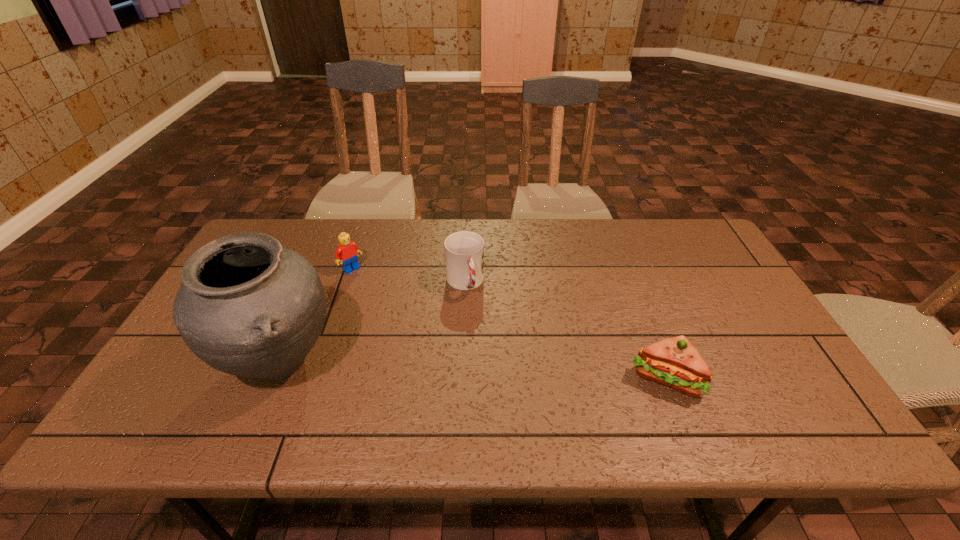
Identify the location of vacant area situated 0.280m on the side of the third object from left to right where the handle is located. Image resolution: width=960 pixels, height=540 pixels. (499, 380).

Identify the location of free space located 0.260m on the side of the third object from left to right where the handle is located. Image resolution: width=960 pixels, height=540 pixels. (497, 374).

Locate an element on the screen. object positioned at the far edge is located at coordinates (347, 252).

You are a GUI agent. You are given a task and a screenshot of the screen. Output one action in this format:
    pyautogui.click(x=<x>, y=<y>)
    Task: Click on the urn at the near edge
    The height and width of the screenshot is (540, 960).
    Given the screenshot: What is the action you would take?
    pyautogui.click(x=249, y=307)

Identify the location of sandwich at the near edge. (674, 362).

The height and width of the screenshot is (540, 960). Identify the location of object that is at the left edge. (249, 307).

This screenshot has height=540, width=960. I want to click on object at the near left corner, so click(249, 307).

This screenshot has height=540, width=960. I want to click on vacant area at the far edge, so click(x=517, y=261).

The image size is (960, 540). I want to click on blank space at the near edge of the desktop, so click(x=354, y=384).

What are the coordinates of `vacant space at the left edge of the desktop` in the screenshot? It's located at (187, 368).